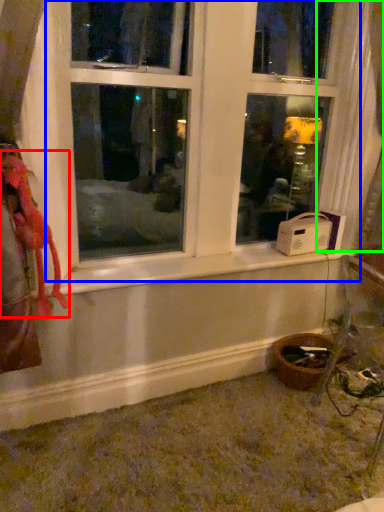
Question: Considering the real-world distances, which object is closest to animal (highlighted by a red box)? window (highlighted by a blue box) or curtain (highlighted by a green box).

Choices:
 (A) window
 (B) curtain

Answer: (A)